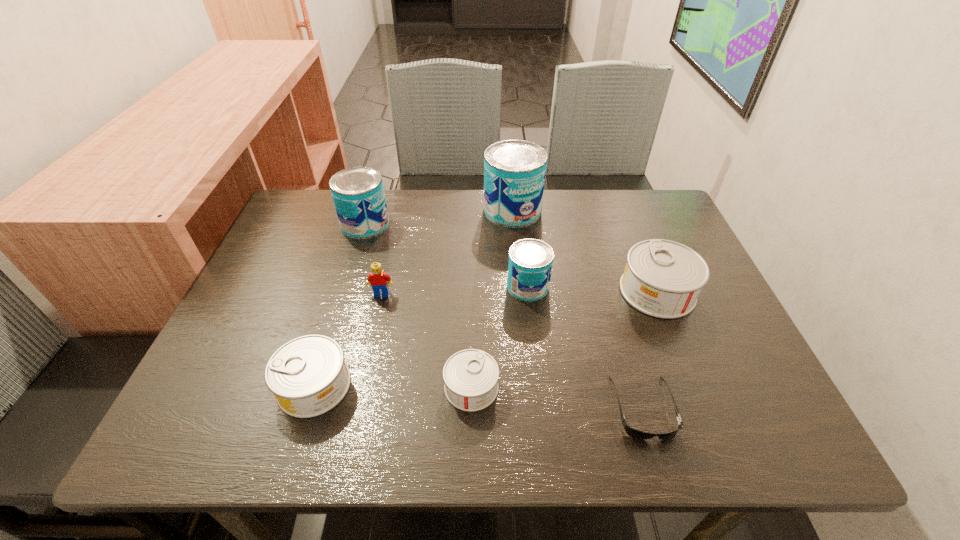
Identify which blue can is the closest to the seventh shortest object. Please provide its 2D coordinates. Your answer should be formatted as a tuple, i.e. [(x, y)], where the tuple contains the x and y coordinates of a point satisfying the conditions above.

[(514, 170)]

You are a GUI agent. You are given a task and a screenshot of the screen. Output one action in this format:
    pyautogui.click(x=<x>, y=<y>)
    Task: Click on the blue can that is the second closest one to the red Lego
    This screenshot has height=540, width=960.
    Given the screenshot: What is the action you would take?
    pyautogui.click(x=530, y=261)

The width and height of the screenshot is (960, 540). Find the location of `silver can that is the closest to the tallest object`. silver can that is the closest to the tallest object is located at coordinates (663, 279).

Select which silver can is the second closest to the tallest object. Please provide its 2D coordinates. Your answer should be formatted as a tuple, i.e. [(x, y)], where the tuple contains the x and y coordinates of a point satisfying the conditions above.

[(470, 376)]

You are a GUI agent. You are given a task and a screenshot of the screen. Output one action in this format:
    pyautogui.click(x=<x>, y=<y>)
    Task: Click on the free space that satisfies the following two spatial constraints: 1. on the face of the shortest can; 2. on the right side of the Lego
    
    Given the screenshot: What is the action you would take?
    pyautogui.click(x=361, y=387)

What are the coordinates of `free space that satisfies the following two spatial constraints: 1. on the front side of the nearest blue can; 2. on the left side of the second biggest blue can` in the screenshot? It's located at (346, 286).